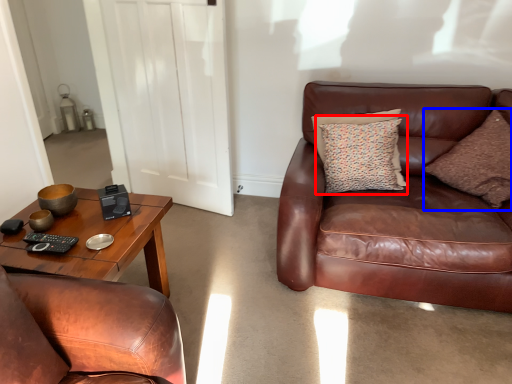
Question: Which point is further to the camera, pillow (highlighted by a red box) or pillow (highlighted by a blue box)?

Choices:
 (A) pillow
 (B) pillow

Answer: (A)